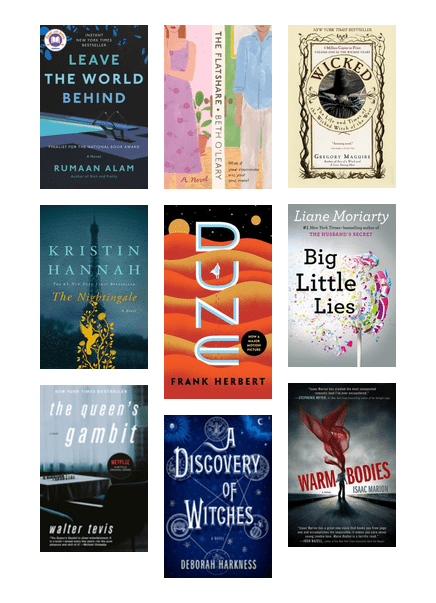
Image resolution: width=436 pixels, height=603 pixels. Identify the location of books. (54, 461), (174, 481), (310, 464), (328, 288), (231, 295), (128, 270), (105, 178), (216, 139), (327, 147).